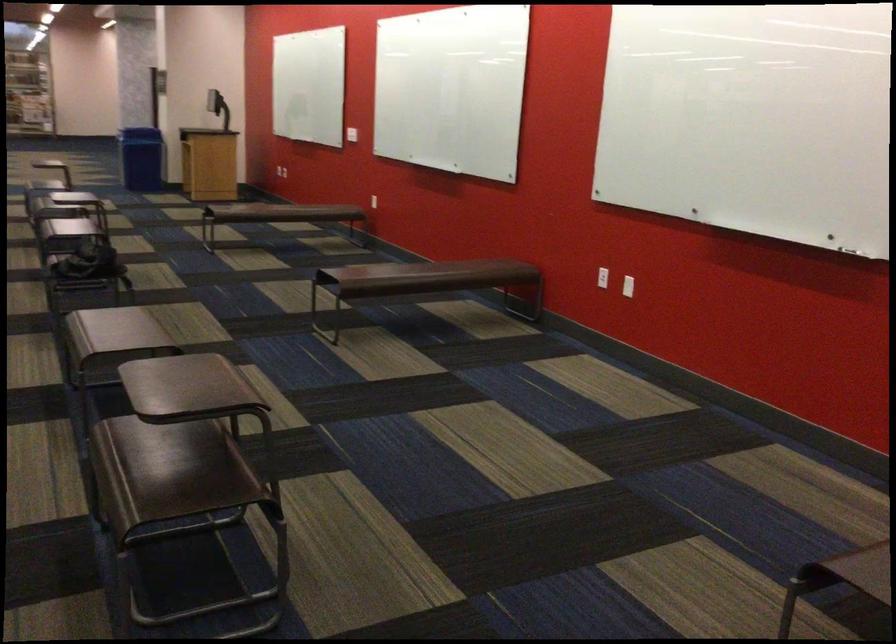
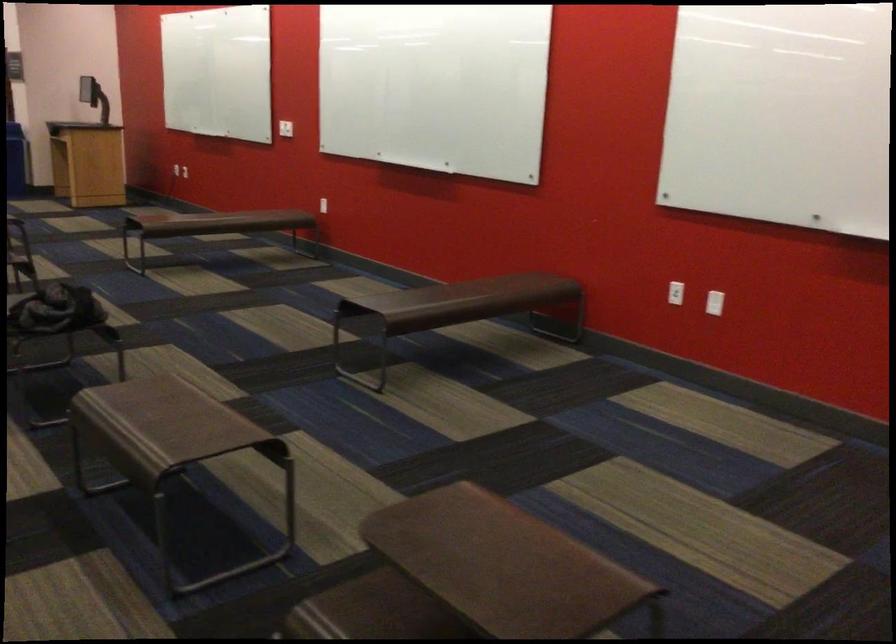
Find the pixel in the second image that matches (x=622, y=285) in the first image.

(713, 303)